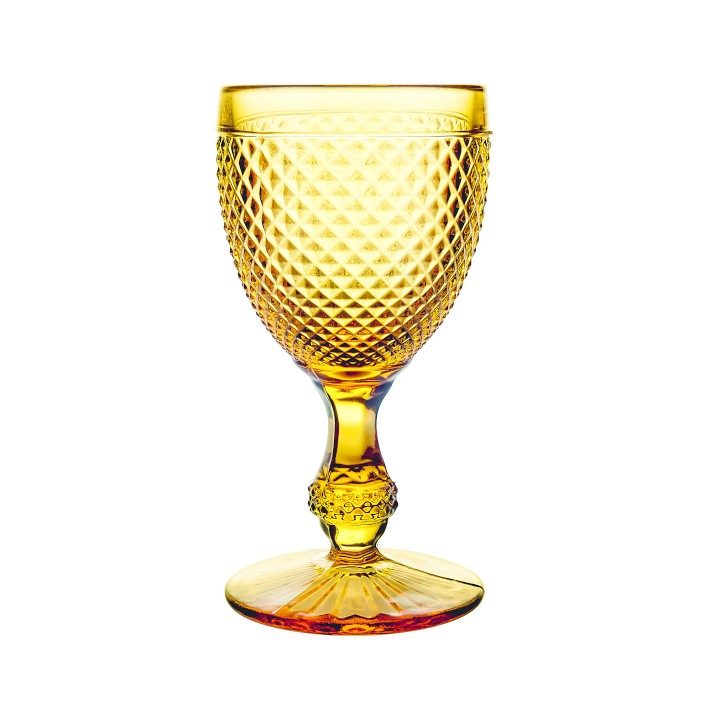
Where is `bottom of cup`? This screenshot has width=710, height=710. bottom of cup is located at coordinates (329, 599), (447, 584), (388, 574), (368, 600), (289, 581), (238, 581).